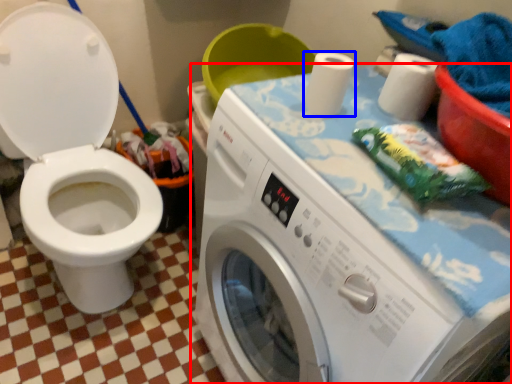
Question: Which object is further to the camera taking this photo, washing machine (highlighted by a red box) or toilet paper (highlighted by a blue box)?

Choices:
 (A) washing machine
 (B) toilet paper

Answer: (B)